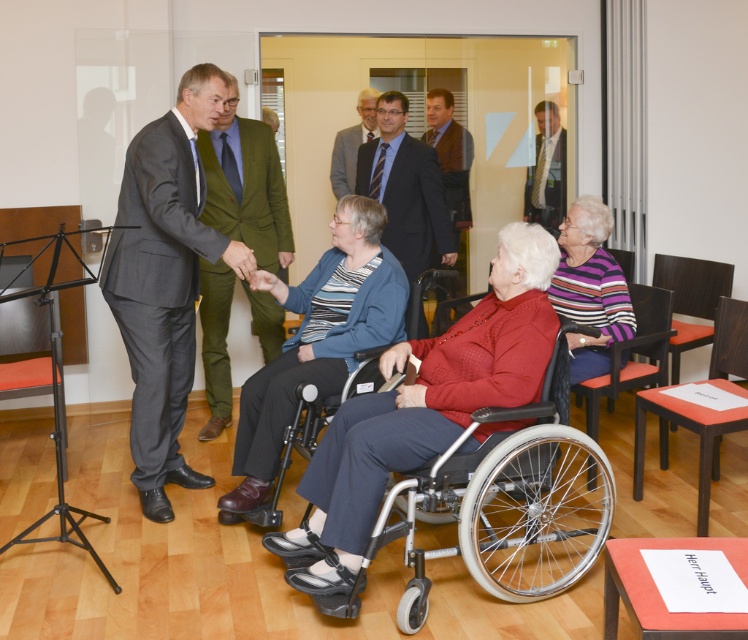
You are standing in the center of the room and need to move to the orange fabric chair at right. According to the coordinates provided, in which direction should you move to reach it?

The orange fabric chair at right is located at coordinates 0.444 on the x axis and 0.926 on the y axis. Since you are at the center, moving towards the right and forward would lead you to the orange fabric chair at right.

You are standing at the point labeled point (462, 204) and want to walk to the exit located at point (672, 340). Is there a clear path directly between these two points?

Yes, since point (672, 340) is in front of point (462, 204), there is a clear path between them.